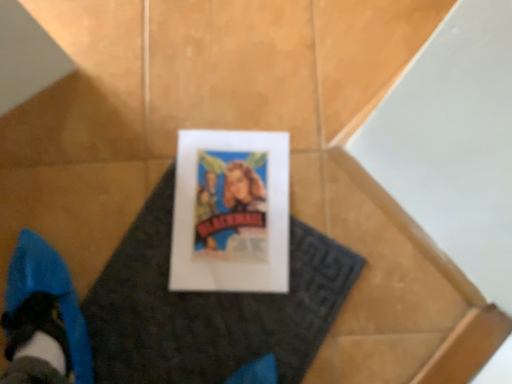
Question: Does white paper at center have a larger size compared to white paper at center?

Choices:
 (A) no
 (B) yes

Answer: (A)

Question: Does white paper at center appear on the left side of white paper at center?

Choices:
 (A) yes
 (B) no

Answer: (B)

Question: From the image's perspective, does white paper at center appear lower than white paper at center?

Choices:
 (A) no
 (B) yes

Answer: (A)

Question: Is white paper at center smaller than white paper at center?

Choices:
 (A) yes
 (B) no

Answer: (A)

Question: From the image's perspective, is white paper at center on white paper at center?

Choices:
 (A) no
 (B) yes

Answer: (B)

Question: Can you confirm if white paper at center is thinner than white paper at center?

Choices:
 (A) yes
 (B) no

Answer: (A)

Question: Is white paper at center bigger than white paper at center?

Choices:
 (A) no
 (B) yes

Answer: (B)

Question: Considering the relative positions of white paper at center and white paper at center in the image provided, is white paper at center to the left of white paper at center from the viewer's perspective?

Choices:
 (A) yes
 (B) no

Answer: (A)

Question: From the image's perspective, is white paper at center located above white paper at center?

Choices:
 (A) no
 (B) yes

Answer: (A)

Question: From a real-world perspective, is white paper at center located beneath white paper at center?

Choices:
 (A) no
 (B) yes

Answer: (B)

Question: Is white paper at center positioned in front of white paper at center?

Choices:
 (A) no
 (B) yes

Answer: (B)

Question: From the image's perspective, is white paper at center located beneath white paper at center?

Choices:
 (A) no
 (B) yes

Answer: (B)

Question: Is white paper at center situated inside white paper at center or outside?

Choices:
 (A) inside
 (B) outside

Answer: (A)